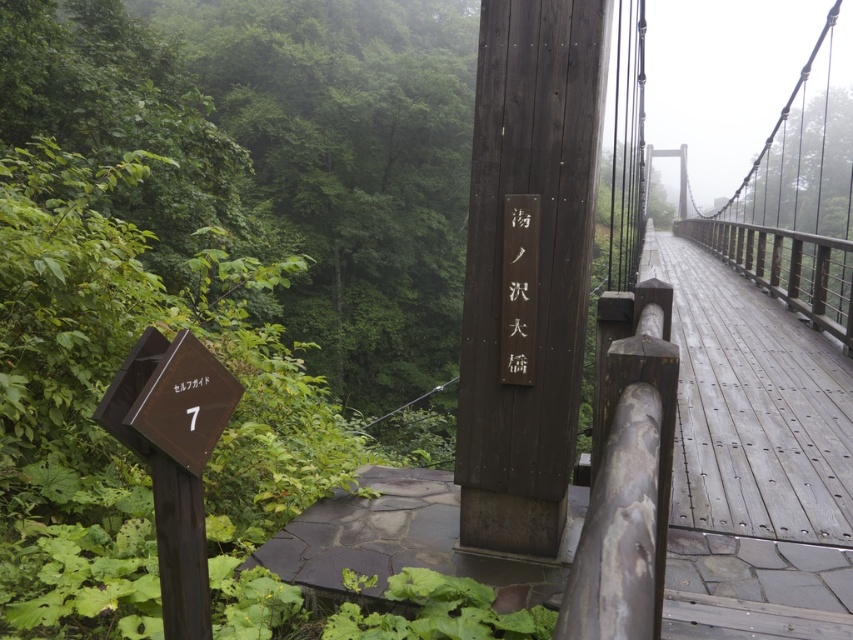
Question: From the image, what is the correct spatial relationship of dark brown wooden suspension bridge at center in relation to brown wooden sign at center?

Choices:
 (A) above
 (B) below

Answer: (A)

Question: Which of these objects is positioned farthest from the dark brown wooden suspension bridge at center?

Choices:
 (A) brown wooden sign at center
 (B) wooden sign at center

Answer: (A)

Question: Which object is positioned farthest from the dark brown wooden suspension bridge at center?

Choices:
 (A) brown wooden sign at lower left
 (B) wooden bridge at center
 (C) brown wooden sign at center

Answer: (A)

Question: Is brown wooden sign at center to the left of brown wooden sign at lower left from the viewer's perspective?

Choices:
 (A) no
 (B) yes

Answer: (A)

Question: Is wooden bridge at center to the left of brown wooden sign at lower left from the viewer's perspective?

Choices:
 (A) no
 (B) yes

Answer: (A)

Question: Considering the real-world distances, which object is closest to the wooden bridge at center?

Choices:
 (A) dark brown wooden suspension bridge at center
 (B) brown wooden sign at center

Answer: (A)